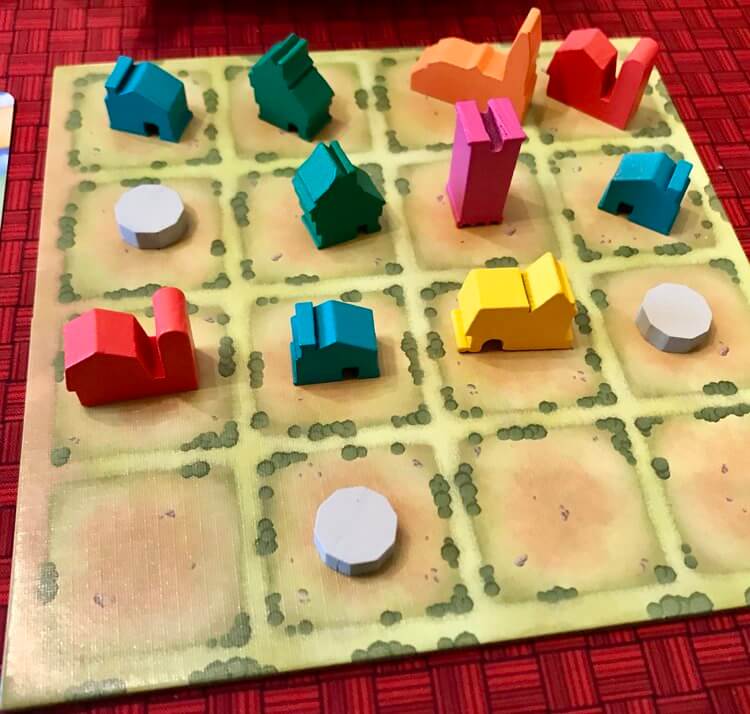
This screenshot has height=714, width=750. In order to click on red tablecloth/background in this screenshot , I will do `click(726, 108)`, `click(590, 652)`, `click(70, 35)`, `click(15, 325)`.